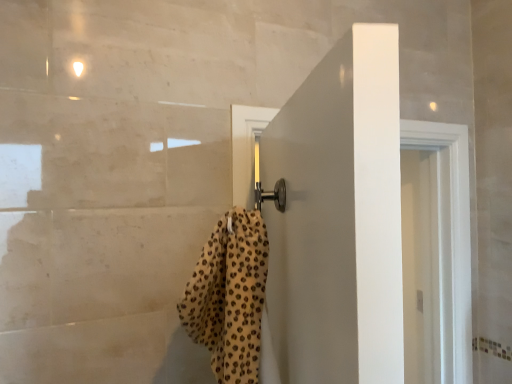
Describe the element at coordinates (230, 296) in the screenshot. The height and width of the screenshot is (384, 512). I see `leopard print towel at center` at that location.

Image resolution: width=512 pixels, height=384 pixels. I want to click on leopard print towel at center, so click(x=230, y=296).

What do you see at coordinates (338, 217) in the screenshot? The width and height of the screenshot is (512, 384). I see `white matte door at center` at bounding box center [338, 217].

Find the location of a particular element. Image resolution: width=512 pixels, height=384 pixels. white matte door at center is located at coordinates (338, 217).

Locate an element on the screen. The height and width of the screenshot is (384, 512). leopard print towel at center is located at coordinates (230, 296).

Which object is positioned more to the right, leopard print towel at center or white matte door at center?

From the viewer's perspective, white matte door at center appears more on the right side.

Relative to white matte door at center, is leopard print towel at center in front or behind?

In the image, leopard print towel at center appears in front of white matte door at center.

Between point (255, 226) and point (303, 311), which one is positioned behind?

The point (255, 226) is farther from the camera.

From the image's perspective, relative to white matte door at center, is leopard print towel at center above or below?

Clearly, from the image's perspective, leopard print towel at center is above white matte door at center.

From a real-world perspective, is leopard print towel at center over white matte door at center?

Yes, from a real-world perspective, leopard print towel at center is above white matte door at center.

Considering the sizes of objects leopard print towel at center and white matte door at center in the image provided, who is thinner, leopard print towel at center or white matte door at center?

white matte door at center.

In terms of height, does leopard print towel at center look taller or shorter compared to white matte door at center?

Considering their sizes, leopard print towel at center has less height than white matte door at center.

Between leopard print towel at center and white matte door at center, which one has larger size?

white matte door at center.

Would you say leopard print towel at center is inside or outside white matte door at center?

leopard print towel at center exists outside the volume of white matte door at center.

Would you consider leopard print towel at center to be distant from white matte door at center?

No.

Is leopard print towel at center looking in the opposite direction of white matte door at center?

No.

What's the angular difference between leopard print towel at center and white matte door at center's facing directions?

leopard print towel at center and white matte door at center are facing 110 degrees away from each other.

How much distance is there between leopard print towel at center and white matte door at center?

leopard print towel at center is 6.31 inches away from white matte door at center.

Where is `door located underneath the leopard print towel at center (from a real-world perspective)`? The image size is (512, 384). door located underneath the leopard print towel at center (from a real-world perspective) is located at coordinates (338, 217).

Can you confirm if white matte door at center is positioned to the left of leopard print towel at center?

In fact, white matte door at center is to the right of leopard print towel at center.

Is white matte door at center closer to the viewer compared to leopard print towel at center?

No, the depth of white matte door at center is greater than that of leopard print towel at center.

Does point (336, 175) lie in front of point (199, 326)?

Yes, point (336, 175) is closer to viewer.

From the image's perspective, is white matte door at center above leopard print towel at center?

No, from the image's perspective, white matte door at center is not over leopard print towel at center.

From a real-world perspective, which object rests below the other?

white matte door at center is physically lower.

Can you confirm if white matte door at center is thinner than leopard print towel at center?

Correct, the width of white matte door at center is less than that of leopard print towel at center.

In terms of height, does white matte door at center look taller or shorter compared to leopard print towel at center?

white matte door at center is taller than leopard print towel at center.

Who is bigger, white matte door at center or leopard print towel at center?

With larger size is white matte door at center.

Which is correct: white matte door at center is inside leopard print towel at center, or outside of it?

white matte door at center exists outside the volume of leopard print towel at center.

Is white matte door at center not close to leopard print towel at center?

No, white matte door at center is not far away from leopard print towel at center.

Is white matte door at center facing away from leopard print towel at center?

No, white matte door at center's orientation is not away from leopard print towel at center.

The height and width of the screenshot is (384, 512). Identify the location of bath towel above the white matte door at center (from a real-world perspective). (230, 296).

Where is `door behind the leopard print towel at center`? This screenshot has height=384, width=512. door behind the leopard print towel at center is located at coordinates (338, 217).

Where is `door below the leopard print towel at center (from a real-world perspective)`? door below the leopard print towel at center (from a real-world perspective) is located at coordinates (338, 217).